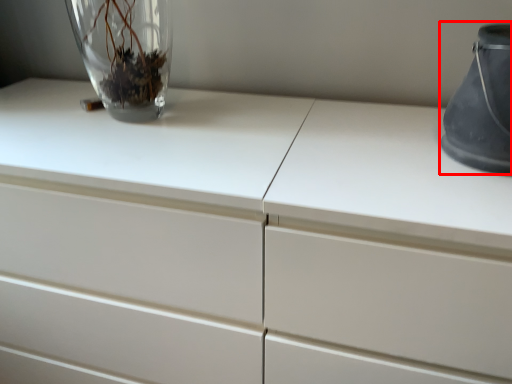
Question: Considering the relative positions of vase (annotated by the red box) and vase in the image provided, where is vase (annotated by the red box) located with respect to the staircase?

Choices:
 (A) right
 (B) left

Answer: (A)